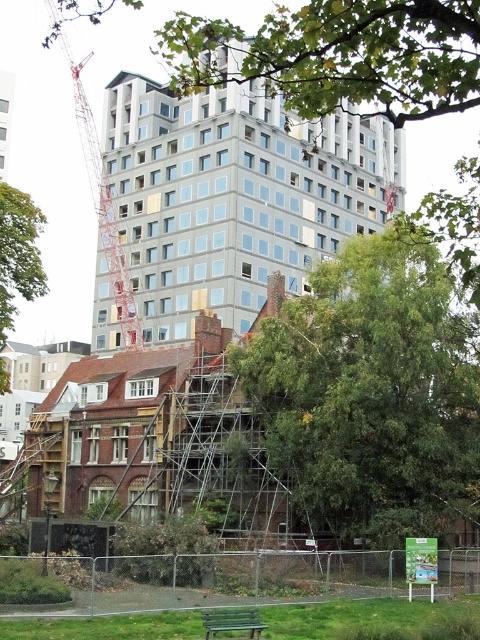
Is green leafy tree at center wider than green leafy tree at upper center?

No.

Which is in front, point (441, 461) or point (314, 19)?

Point (314, 19) is in front.

Where is `green leafy tree at center`? The image size is (480, 640). green leafy tree at center is located at coordinates (372, 394).

Based on the photo, does green leafy tree at left have a greater height compared to green painted wood park bench at lower center?

Yes, green leafy tree at left is taller than green painted wood park bench at lower center.

Looking at this image, who is more forward, (24, 269) or (262, 625)?

Point (262, 625) is in front.

Is point (41, 266) positioned in front of point (252, 625)?

No.

Where is `green leafy tree at left`? green leafy tree at left is located at coordinates (17, 253).

Is green leafy tree at upper center closer to the viewer compared to green painted wood park bench at lower center?

Yes, green leafy tree at upper center is closer to the viewer.

Does green leafy tree at upper center have a lesser width compared to green painted wood park bench at lower center?

In fact, green leafy tree at upper center might be wider than green painted wood park bench at lower center.

The height and width of the screenshot is (640, 480). I want to click on green leafy tree at upper center, so (x=340, y=54).